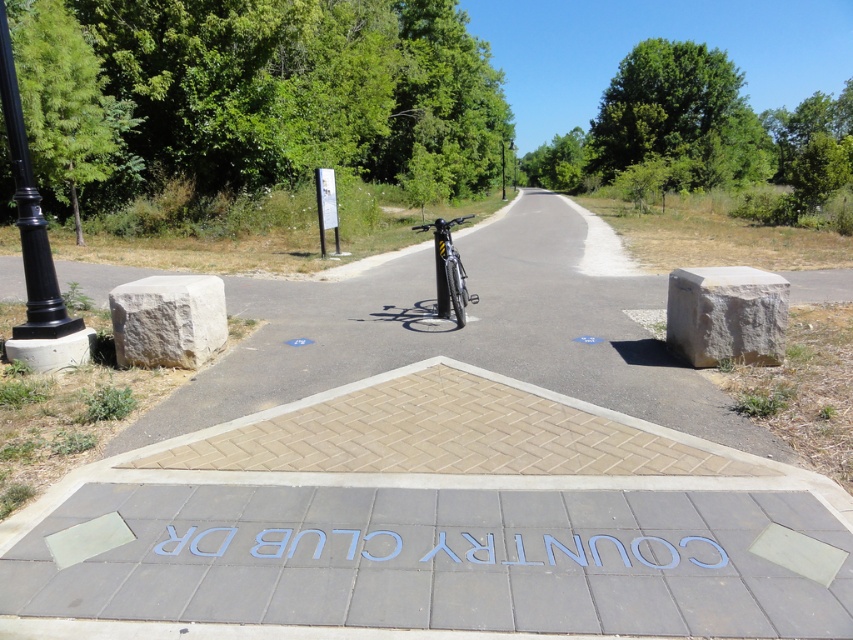
You are a delivery person who needs to park your shiny silver bicycle at center near the black metal lamp post at upper center. Can you tell me where exactly should I park the bicycle relative to the lamp post?

The shiny silver bicycle at center should be parked below the black metal lamp post at upper center as it is already positioned there.

You are a delivery person trying to secure your shiny silver bicycle at center to the black polished metal pole at left. Can you easily attach the bicycle to the pole without any obstruction?

The black polished metal pole at left is positioned under the shiny silver bicycle at center, so the bicycle is already secured to the pole. There should be no obstruction in attaching it further.

You are a delivery person trying to locate the entrance to Country Club Drive. You see the black polished metal pole at left and the black metal lamp post at upper center. Which object is closer to the entrance?

The black polished metal pole at left is 48.52 meters away from the black metal lamp post at upper center. Since the entrance is likely near the engraved path labeled Country Club Drive, the closer object to the entrance would depend on their positions relative to the path. However, based on the given distance, the black metal lamp post at upper center is closer to the entrance than the black polished metal pole at left because it is only 48.52 meters away.